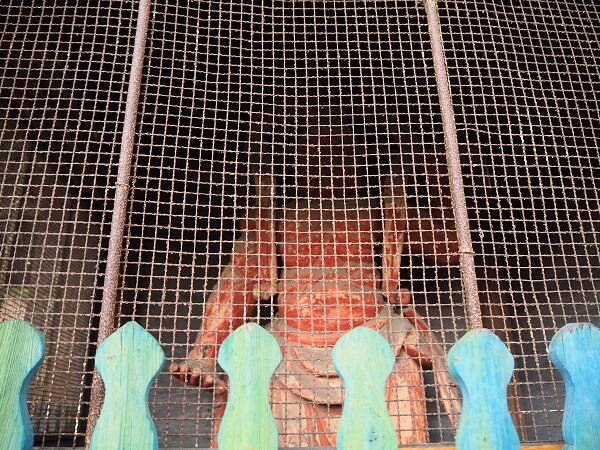
At what (x,y) coordinates should I click in order to perform the action: click on statue. Please return your answer as a coordinate pair (x, y). Looking at the image, I should click on (299, 304).